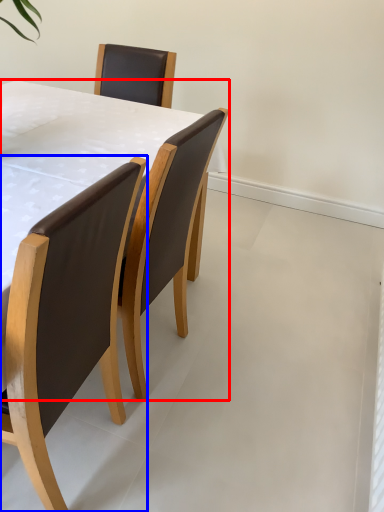
Question: Which of the following is the farthest to the observer, table (highlighted by a red box) or chair (highlighted by a blue box)?

Choices:
 (A) table
 (B) chair

Answer: (A)